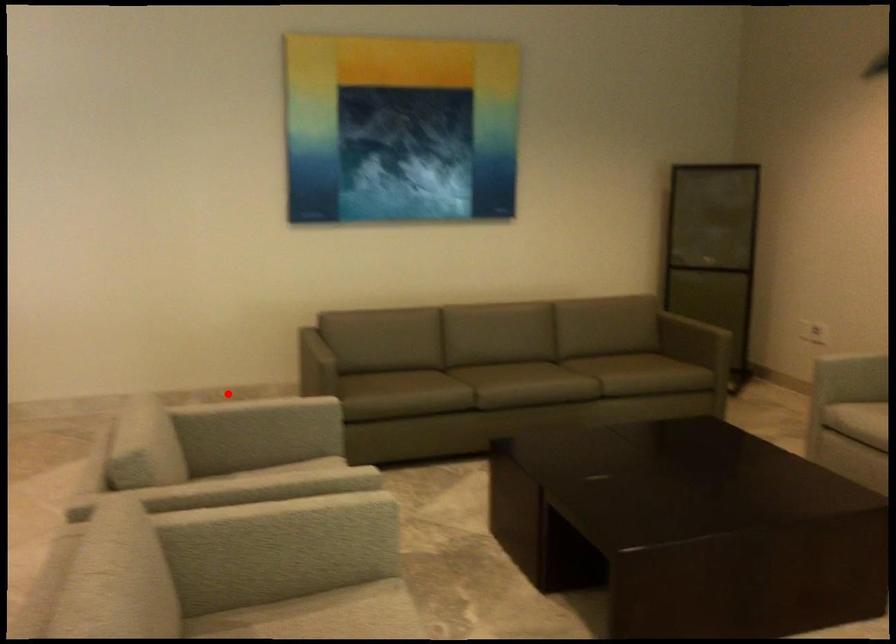
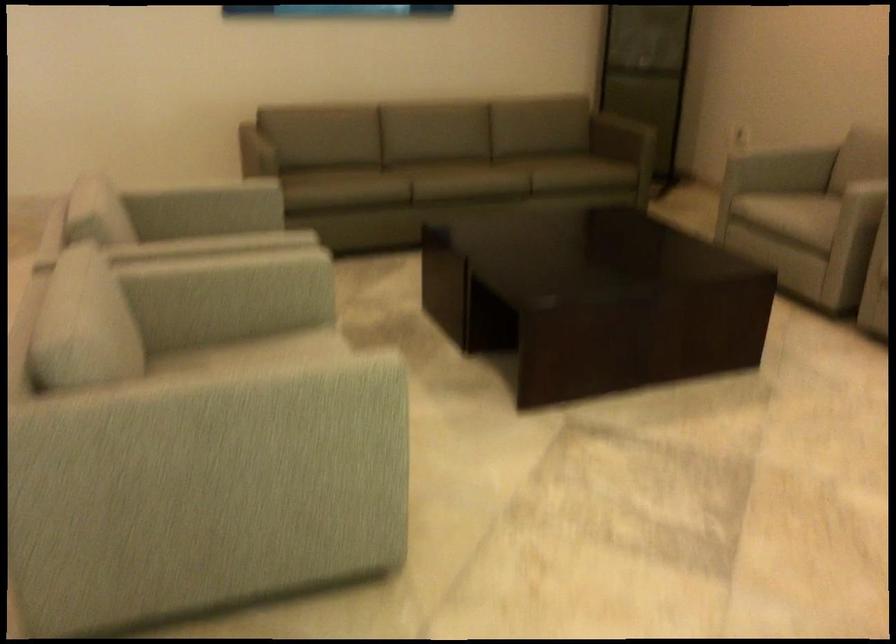
In the second image, find the point that corresponds to the highlighted location in the first image.

(174, 196)